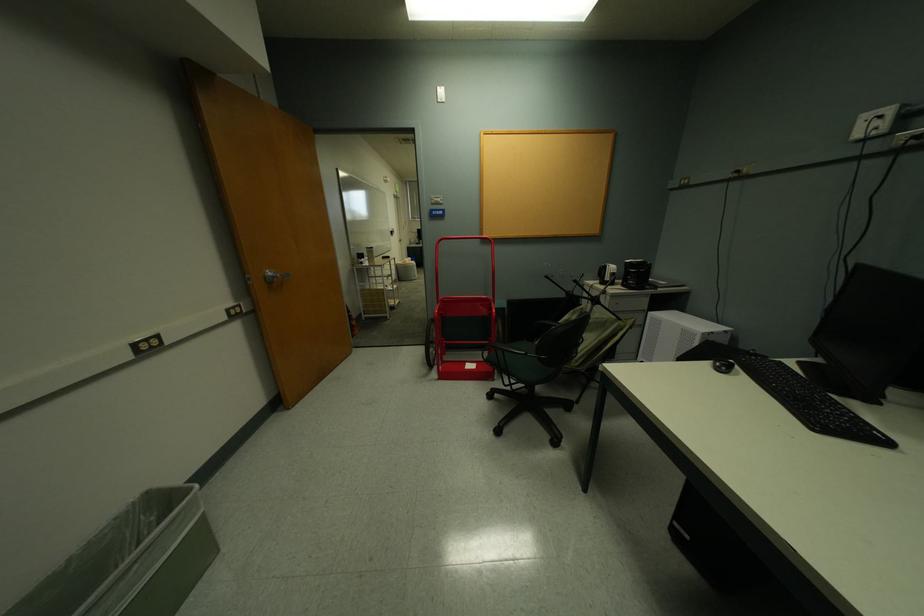
Where is `chair armrest`? chair armrest is located at coordinates (514, 347).